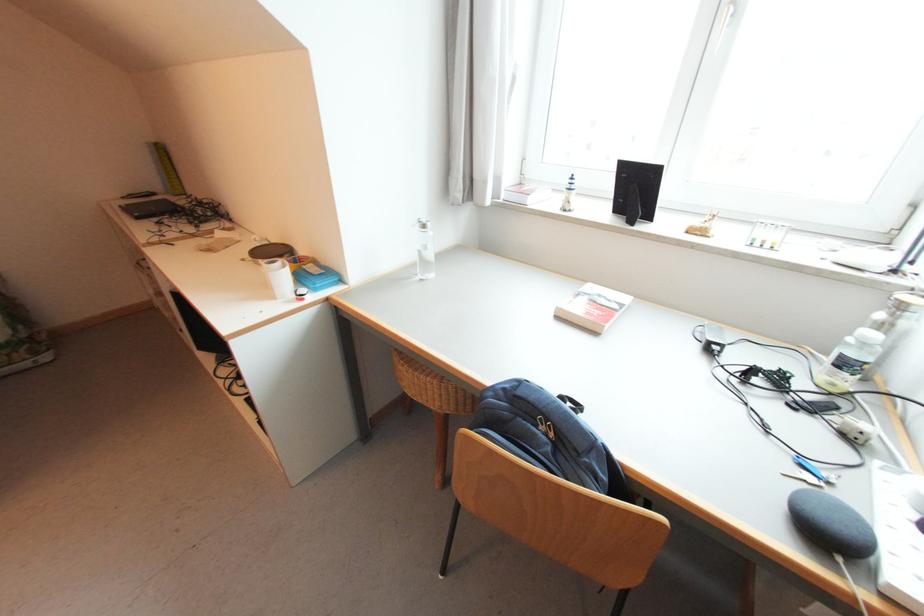
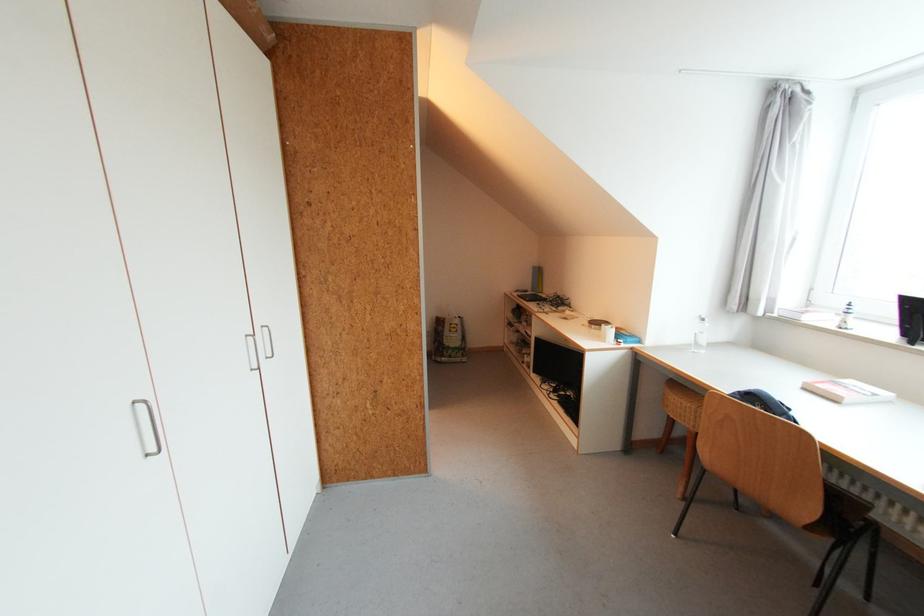
In the second image, find the point that corresponds to (306,277) in the first image.

(625, 334)